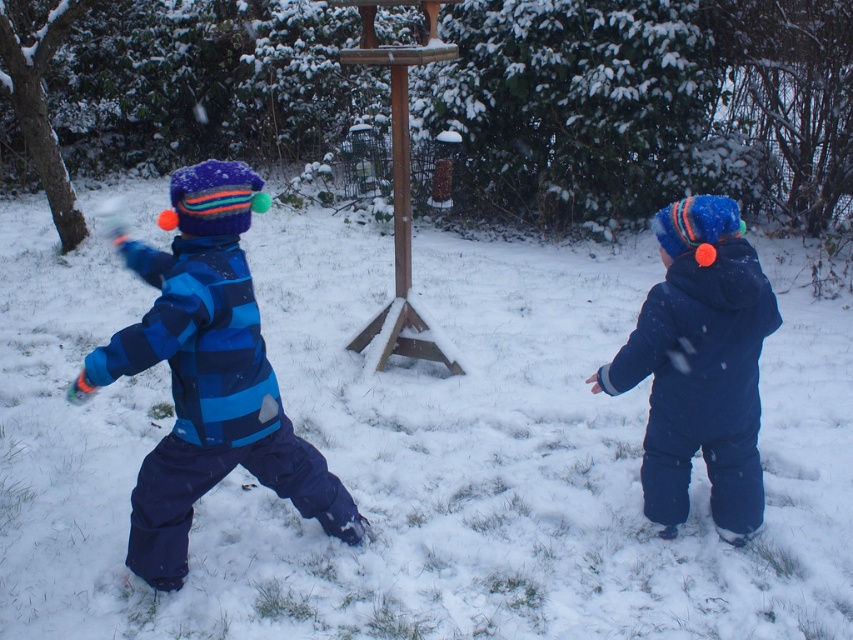
Is blue striped snowsuit at left below matte blue snowsuit at right?

Incorrect, blue striped snowsuit at left is not positioned below matte blue snowsuit at right.

The height and width of the screenshot is (640, 853). I want to click on blue striped snowsuit at left, so click(207, 376).

Which is behind, point (241, 348) or point (669, 353)?

Positioned behind is point (669, 353).

This screenshot has width=853, height=640. Find the location of `blue striped snowsuit at left`. blue striped snowsuit at left is located at coordinates (207, 376).

Who is shorter, blue striped snowsuit at left or wooden bird feeder at center?

With less height is blue striped snowsuit at left.

Between blue striped snowsuit at left and wooden bird feeder at center, which one appears on the left side from the viewer's perspective?

blue striped snowsuit at left is more to the left.

Who is more distant from viewer, (194, 289) or (372, 8)?

The point (372, 8) is more distant.

This screenshot has height=640, width=853. Find the location of `blue striped snowsuit at left`. blue striped snowsuit at left is located at coordinates (207, 376).

Between matte blue snowsuit at right and wooden bird feeder at center, which one is positioned higher?

wooden bird feeder at center is higher up.

Which is more to the left, matte blue snowsuit at right or wooden bird feeder at center?

wooden bird feeder at center

I want to click on matte blue snowsuit at right, so click(700, 365).